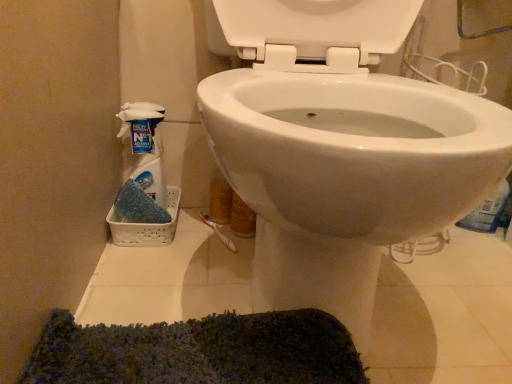
Question: From a real-world perspective, is translucent plastic spray bottle at left above or below white glossy toilet at center?

Choices:
 (A) above
 (B) below

Answer: (B)

Question: Considering the relative positions of translucent plastic spray bottle at left and white glossy toilet at center in the image provided, is translucent plastic spray bottle at left to the left or to the right of white glossy toilet at center?

Choices:
 (A) right
 (B) left

Answer: (B)

Question: In terms of height, does translucent plastic spray bottle at left look taller or shorter compared to white glossy toilet at center?

Choices:
 (A) short
 (B) tall

Answer: (A)

Question: Based on their sizes in the image, would you say white glossy toilet at center is bigger or smaller than translucent plastic spray bottle at left?

Choices:
 (A) big
 (B) small

Answer: (A)

Question: From their relative heights in the image, would you say white glossy toilet at center is taller or shorter than translucent plastic spray bottle at left?

Choices:
 (A) tall
 (B) short

Answer: (A)

Question: Is point (466, 188) positioned closer to the camera than point (136, 124)?

Choices:
 (A) farther
 (B) closer

Answer: (B)

Question: From the image's perspective, is white glossy toilet at center located above or below translucent plastic spray bottle at left?

Choices:
 (A) above
 (B) below

Answer: (A)